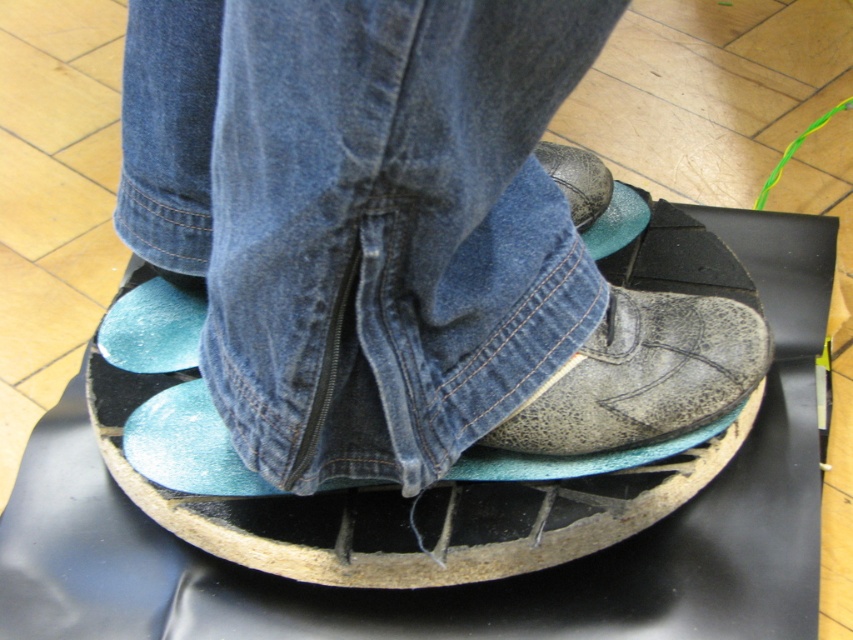
Question: Can you confirm if distressed leather shoe at center is wider than teal suede shoe at center?

Choices:
 (A) yes
 (B) no

Answer: (A)

Question: Which point is farther to the camera?

Choices:
 (A) distressed leather shoe at center
 (B) leather shoe at center

Answer: (B)

Question: Can you confirm if distressed leather shoe at center is positioned to the right of worn leather shoe at center?

Choices:
 (A) yes
 (B) no

Answer: (B)

Question: Which of these objects is positioned closest to the distressed leather shoe at center?

Choices:
 (A) teal suede shoe at center
 (B) worn leather shoe at center
 (C) leather shoe at center

Answer: (B)

Question: Among these points, which one is nearest to the camera?

Choices:
 (A) (608, 358)
 (B) (175, 326)
 (C) (401, 289)

Answer: (C)

Question: Is distressed leather shoe at center wider than leather shoe at center?

Choices:
 (A) no
 (B) yes

Answer: (B)